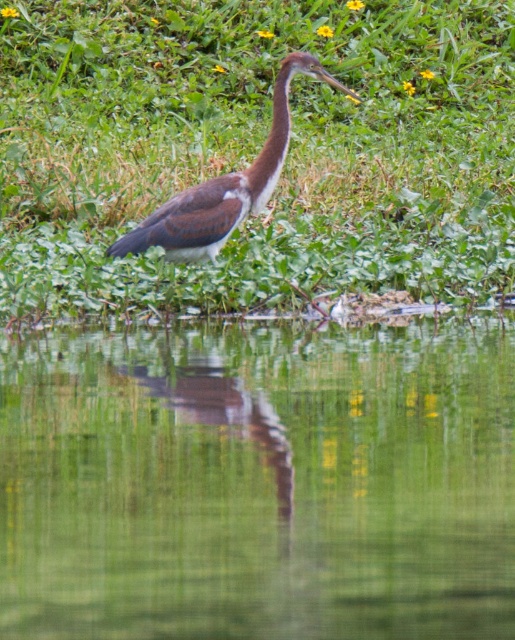
Question: Estimate the real-world distances between objects in this image. Which object is farther from the brown matte neck at center?

Choices:
 (A) green reflective water at center
 (B) green leafy grass at center
 (C) brown matte bird at center

Answer: (B)

Question: Which object is positioned farthest from the brown matte bird at center?

Choices:
 (A) green reflective water at center
 (B) brown matte neck at center
 (C) green leafy grass at center

Answer: (C)

Question: Can you confirm if green leafy grass at center is positioned above brown matte neck at center?

Choices:
 (A) no
 (B) yes

Answer: (B)

Question: Is green reflective water at center further to the viewer compared to brown matte neck at center?

Choices:
 (A) no
 (B) yes

Answer: (A)

Question: Considering the real-world distances, which object is closest to the brown matte bird at center?

Choices:
 (A) brown matte neck at center
 (B) green reflective water at center

Answer: (A)

Question: Can you confirm if green reflective water at center is positioned above brown matte bird at center?

Choices:
 (A) no
 (B) yes

Answer: (A)